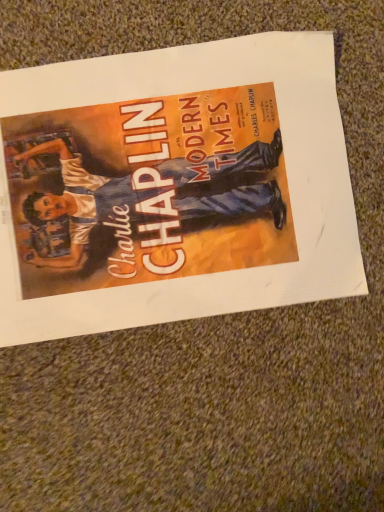
The image size is (384, 512). Find the location of `vacant point above matte paper poster at center (from a real-world perspective)`. vacant point above matte paper poster at center (from a real-world perspective) is located at coordinates (167, 194).